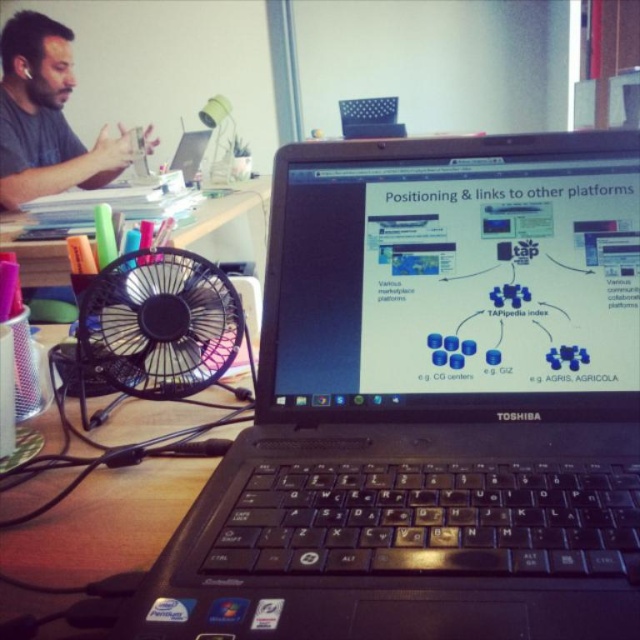
Question: Does black plastic fan at lower left appear over matte black laptop at upper left?

Choices:
 (A) no
 (B) yes

Answer: (A)

Question: Can you confirm if matte black laptop at upper left is bigger than black plastic fan at left?

Choices:
 (A) no
 (B) yes

Answer: (B)

Question: Estimate the real-world distances between objects in this image. Which object is farther from the black plastic laptop at center?

Choices:
 (A) black plastic fan at lower left
 (B) matte black laptop at upper left
 (C) black plastic fan at left

Answer: (B)

Question: Is black plastic fan at lower left bigger than matte black laptop at upper left?

Choices:
 (A) no
 (B) yes

Answer: (A)

Question: Considering the real-world distances, which object is closest to the black plastic fan at left?

Choices:
 (A) black plastic laptop at center
 (B) matte black laptop at upper left
 (C) black plastic fan at lower left

Answer: (B)

Question: Which is nearer to the black plastic fan at left?

Choices:
 (A) black plastic laptop at center
 (B) black plastic fan at lower left
 (C) matte black laptop at upper left

Answer: (C)